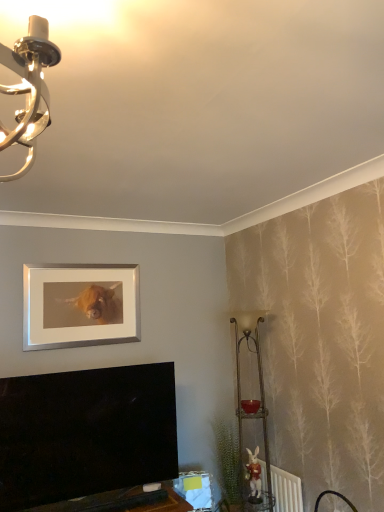
Question: Is white plastic radiator at lower right positioned beyond the bounds of silver/metallic picture frame at upper center?

Choices:
 (A) no
 (B) yes

Answer: (B)

Question: Does white plastic radiator at lower right have a larger size compared to silver/metallic picture frame at upper center?

Choices:
 (A) yes
 (B) no

Answer: (B)

Question: Is white plastic radiator at lower right thinner than silver/metallic picture frame at upper center?

Choices:
 (A) yes
 (B) no

Answer: (B)

Question: Can you confirm if white plastic radiator at lower right is smaller than silver/metallic picture frame at upper center?

Choices:
 (A) no
 (B) yes

Answer: (B)

Question: From the image's perspective, is white plastic radiator at lower right located above silver/metallic picture frame at upper center?

Choices:
 (A) no
 (B) yes

Answer: (A)

Question: From the image's perspective, relative to white plastic radiator at lower right, is metallic gold table lamp at right above or below?

Choices:
 (A) above
 (B) below

Answer: (A)

Question: In the image, is metallic gold table lamp at right on the left side or the right side of white plastic radiator at lower right?

Choices:
 (A) left
 (B) right

Answer: (A)

Question: Based on their sizes in the image, would you say metallic gold table lamp at right is bigger or smaller than white plastic radiator at lower right?

Choices:
 (A) big
 (B) small

Answer: (A)

Question: In terms of width, does metallic gold table lamp at right look wider or thinner when compared to white plastic radiator at lower right?

Choices:
 (A) thin
 (B) wide

Answer: (B)

Question: Relative to green leafy plant at lower right, is silver/metallic picture frame at upper center in front or behind?

Choices:
 (A) behind
 (B) front

Answer: (B)

Question: Considering the positions of silver/metallic picture frame at upper center and green leafy plant at lower right in the image, is silver/metallic picture frame at upper center wider or thinner than green leafy plant at lower right?

Choices:
 (A) wide
 (B) thin

Answer: (B)

Question: Is silver/metallic picture frame at upper center spatially inside green leafy plant at lower right, or outside of it?

Choices:
 (A) inside
 (B) outside

Answer: (B)

Question: From their relative heights in the image, would you say silver/metallic picture frame at upper center is taller or shorter than green leafy plant at lower right?

Choices:
 (A) short
 (B) tall

Answer: (A)

Question: In the image, is silver/metallic picture frame at upper center on the left side or the right side of metallic gold table lamp at right?

Choices:
 (A) right
 (B) left

Answer: (B)

Question: In terms of size, does silver/metallic picture frame at upper center appear bigger or smaller than metallic gold table lamp at right?

Choices:
 (A) big
 (B) small

Answer: (B)